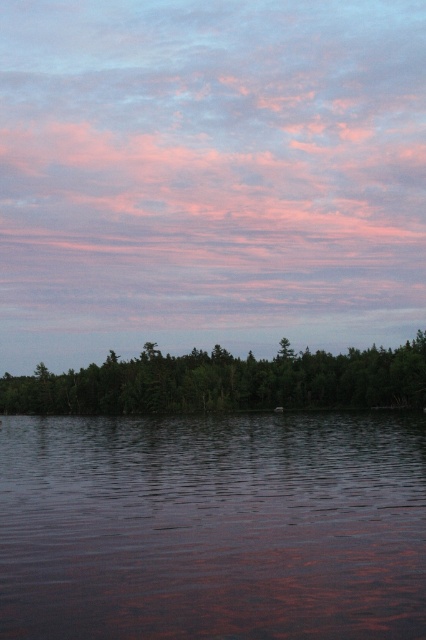
You are a photographer standing at the lakeside. You want to capture the reflection of the pink fluffy clouds at upper center in the smooth dark water at center. Is the position of the clouds suitable for this?

The pink fluffy clouds at upper center are located above the smooth dark water at center, so their reflection should be visible in the water, making their position suitable for capturing the reflection.

You are standing at the origin point of the coordinate system. You want to walk to the smooth dark water at center. Which direction should you go?

The smooth dark water at center is located at point 0.825 on the x axis and 0.500 on the y axis. Since you are at the origin, you should move towards the positive x direction to reach the smooth dark water at center.